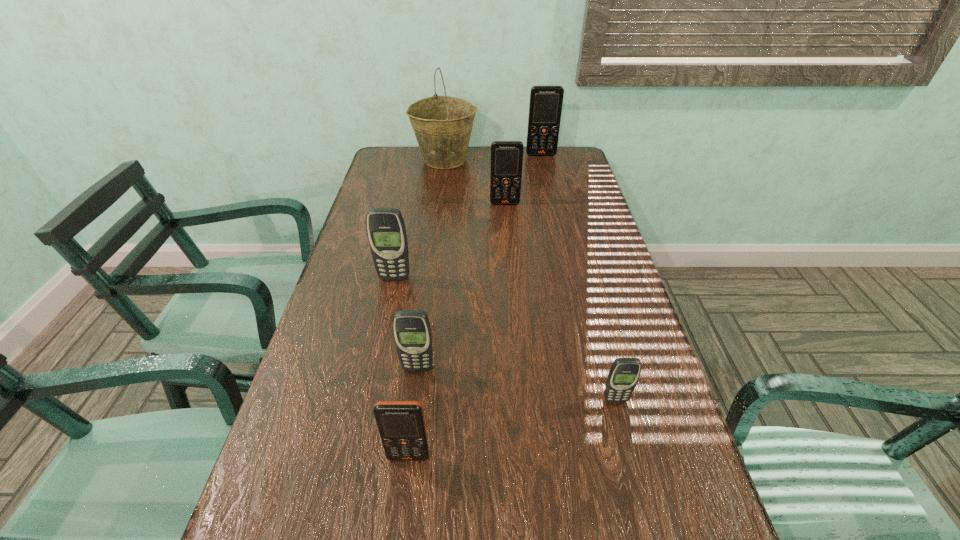
Find the location of a particular element. The height and width of the screenshot is (540, 960). vacant space that's between the wine bucket and the second biggest gray cellular telephone is located at coordinates pos(431,264).

Image resolution: width=960 pixels, height=540 pixels. In order to click on vacant area that lies between the nearest gray cellular telephone and the tallest object in this screenshot , I will do `click(530, 280)`.

This screenshot has width=960, height=540. What are the coordinates of `blank region between the rightmost orange cellular telephone and the fourth nearest object` in the screenshot? It's located at (468, 217).

This screenshot has height=540, width=960. In order to click on free spot between the third farthest object and the leftmost gray cellular telephone in this screenshot , I will do `click(449, 241)`.

The image size is (960, 540). Identify the location of free space between the leftmost gray cellular telephone and the wine bucket. (420, 219).

Locate an element on the screen. This screenshot has width=960, height=540. free space that is in between the nearest cellular telephone and the leftmost cellular telephone is located at coordinates (401, 367).

In order to click on free spot between the fourth farthest cellular telephone and the wine bucket in this screenshot , I will do `click(431, 264)`.

Identify the location of free space between the fifth farthest cellular telephone and the leftmost orange cellular telephone. (512, 428).

What are the coordinates of `unoccupied area between the leftmost orange cellular telephone and the tallest object` in the screenshot? It's located at (426, 308).

Choose which object is the nearest neighbor to the rightmost orange cellular telephone. Please provide its 2D coordinates. Your answer should be formatted as a tuple, i.e. [(x, y)], where the tuple contains the x and y coordinates of a point satisfying the conditions above.

[(442, 125)]